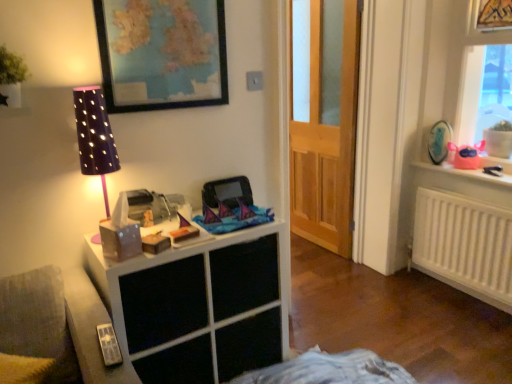
Question: Does pink plastic bag at upper right have a smaller size compared to purple dotted fabric at left?

Choices:
 (A) no
 (B) yes

Answer: (B)

Question: Can you confirm if pink plastic bag at upper right is shorter than purple dotted fabric at left?

Choices:
 (A) yes
 (B) no

Answer: (A)

Question: Is pink plastic bag at upper right oriented towards purple dotted fabric at left?

Choices:
 (A) yes
 (B) no

Answer: (B)

Question: Is pink plastic bag at upper right closer to the viewer compared to purple dotted fabric at left?

Choices:
 (A) no
 (B) yes

Answer: (A)

Question: Is pink plastic bag at upper right oriented away from purple dotted fabric at left?

Choices:
 (A) yes
 (B) no

Answer: (B)

Question: Does pink plastic bag at upper right have a greater width compared to purple dotted fabric at left?

Choices:
 (A) yes
 (B) no

Answer: (A)

Question: From the image's perspective, does white matte cabinet at left appear higher than pink plastic toy at upper right?

Choices:
 (A) yes
 (B) no

Answer: (B)

Question: Is white matte cabinet at left outside of pink plastic toy at upper right?

Choices:
 (A) yes
 (B) no

Answer: (A)

Question: Is white matte cabinet at left wider than pink plastic toy at upper right?

Choices:
 (A) yes
 (B) no

Answer: (A)

Question: Can you confirm if white matte cabinet at left is positioned to the left of pink plastic toy at upper right?

Choices:
 (A) yes
 (B) no

Answer: (A)

Question: Is white matte cabinet at left closer to the viewer compared to pink plastic toy at upper right?

Choices:
 (A) no
 (B) yes

Answer: (B)

Question: Is white matte cabinet at left further to the viewer compared to pink plastic toy at upper right?

Choices:
 (A) yes
 (B) no

Answer: (B)

Question: Is gold metallic picture frame at upper right, placed as the first picture frame when sorted from top to bottom, smaller than pink plastic toy at upper right?

Choices:
 (A) no
 (B) yes

Answer: (B)